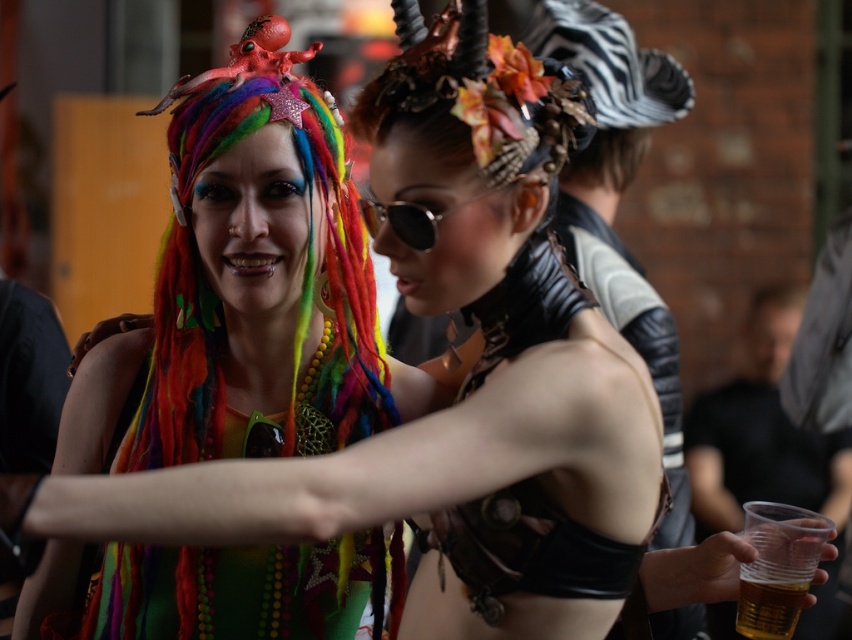
Between brown matte hair at center and translucent plastic cup at lower right, which one has less height?

translucent plastic cup at lower right is shorter.

Which is below, brown matte hair at center or translucent plastic cup at lower right?

translucent plastic cup at lower right is below.

Locate an element on the screen. The image size is (852, 640). brown matte hair at center is located at coordinates (606, 160).

Identify the location of brown matte hair at center. The width and height of the screenshot is (852, 640). (606, 160).

Does rainbow fabric headdress at upper left appear over translucent plastic cup at lower right?

Yes, rainbow fabric headdress at upper left is above translucent plastic cup at lower right.

Can you confirm if rainbow fabric headdress at upper left is wider than translucent plastic cup at lower right?

Indeed, rainbow fabric headdress at upper left has a greater width compared to translucent plastic cup at lower right.

Where is `rainbow fabric headdress at upper left`? The image size is (852, 640). rainbow fabric headdress at upper left is located at coordinates (223, 291).

Image resolution: width=852 pixels, height=640 pixels. In order to click on rainbow fabric headdress at upper left in this screenshot , I will do `click(223, 291)`.

Is point (209, 120) more distant than point (573, 170)?

No, it is in front of (573, 170).

Does rainbow fabric headdress at upper left have a greater width compared to brown matte hair at center?

Indeed, rainbow fabric headdress at upper left has a greater width compared to brown matte hair at center.

Locate an element on the screen. The image size is (852, 640). rainbow fabric headdress at upper left is located at coordinates (223, 291).